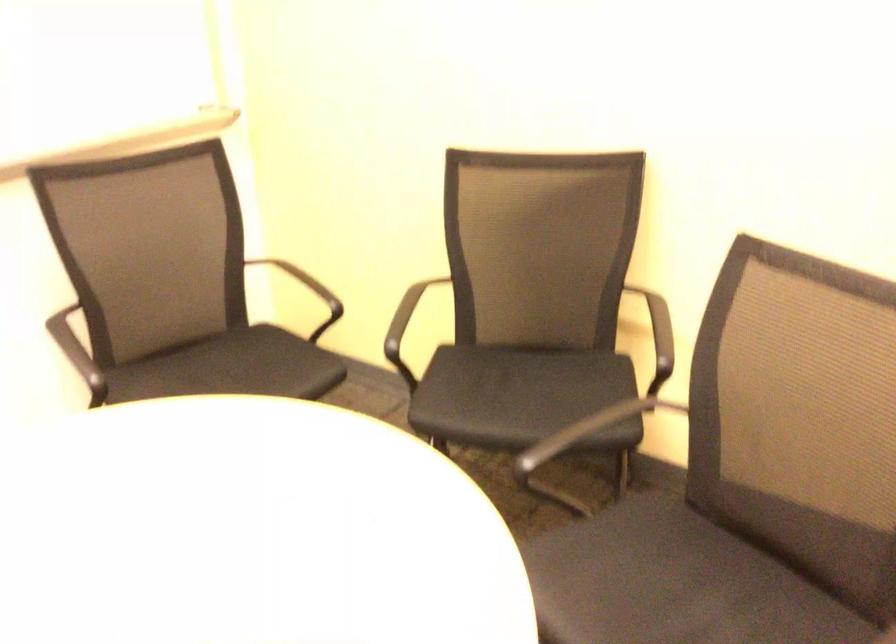
Question: The camera is either moving clockwise (left) or counter-clockwise (right) around the object. The first image is from the beginning of the video and the second image is from the end. Is the camera moving left or right when shooting the video?

Choices:
 (A) Left
 (B) Right

Answer: (B)